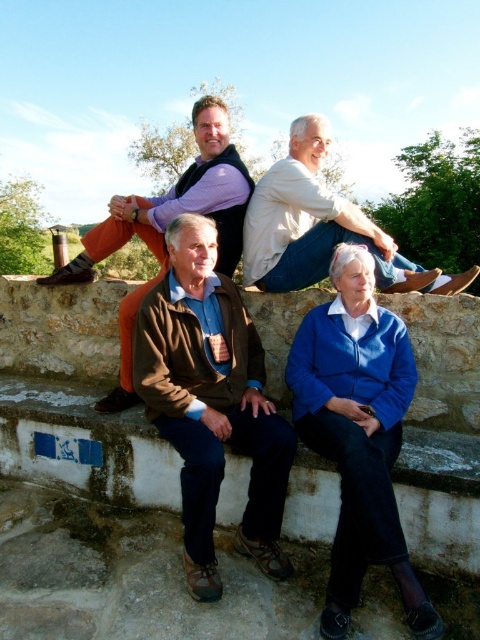
Question: Is blue leather jacket at lower right smaller than light beige sweater at upper center?

Choices:
 (A) no
 (B) yes

Answer: (A)

Question: Is light beige sweater at upper center bigger than matte purple shirt at upper center?

Choices:
 (A) yes
 (B) no

Answer: (A)

Question: Which point is closer to the camera taking this photo?

Choices:
 (A) (215, 253)
 (B) (334, 388)
 (C) (83, 259)
 (D) (313, 184)

Answer: (B)

Question: Is light beige sweater at upper center positioned in front of matte purple shirt at upper center?

Choices:
 (A) yes
 (B) no

Answer: (A)

Question: Which object is the closest to the brown leather jacket at center?

Choices:
 (A) light beige sweater at upper center
 (B) blue leather jacket at lower right
 (C) matte purple shirt at upper center

Answer: (B)

Question: Which point is closer to the camera?

Choices:
 (A) matte purple shirt at upper center
 (B) brown leather jacket at center

Answer: (B)